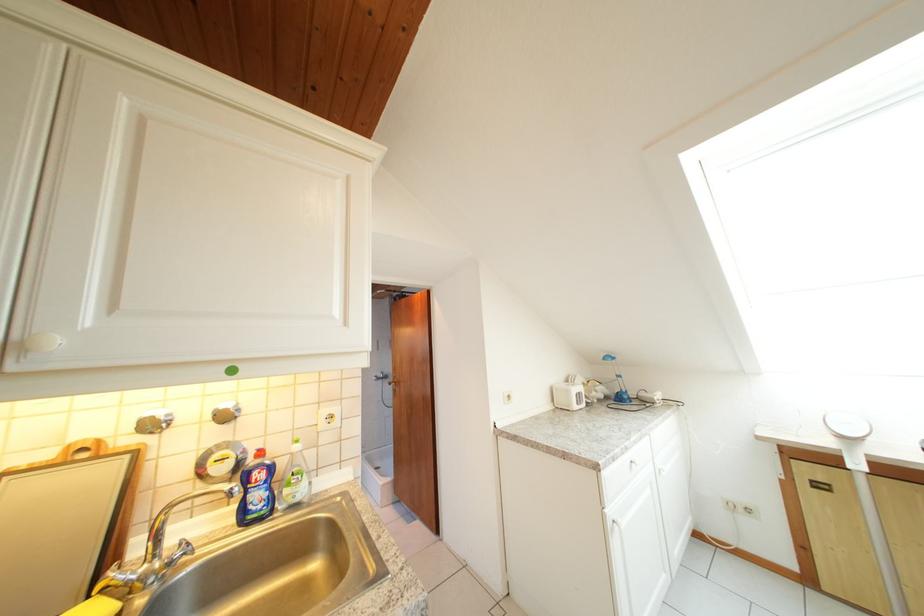
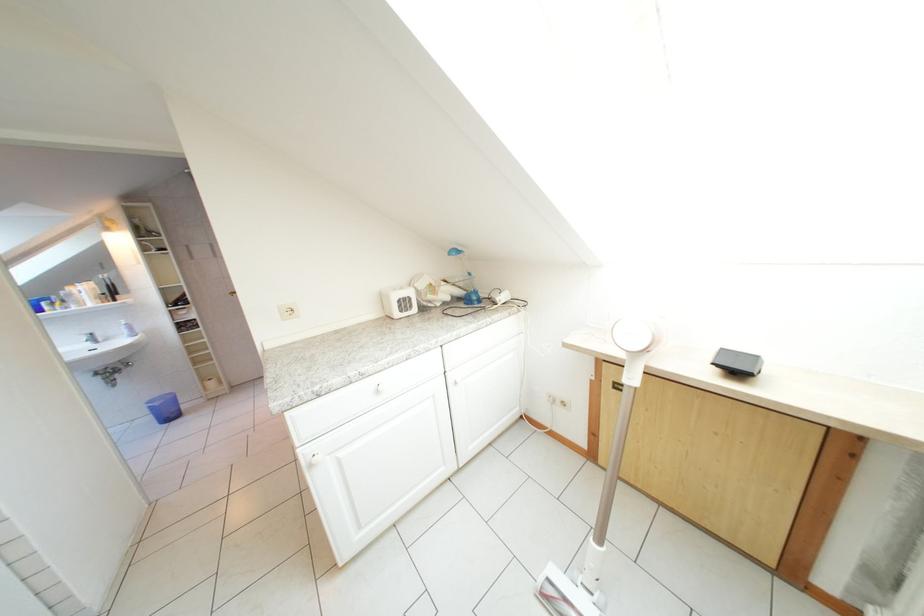
What movement of the cameraman would produce the second image?

The cameraman moved toward right, forward.